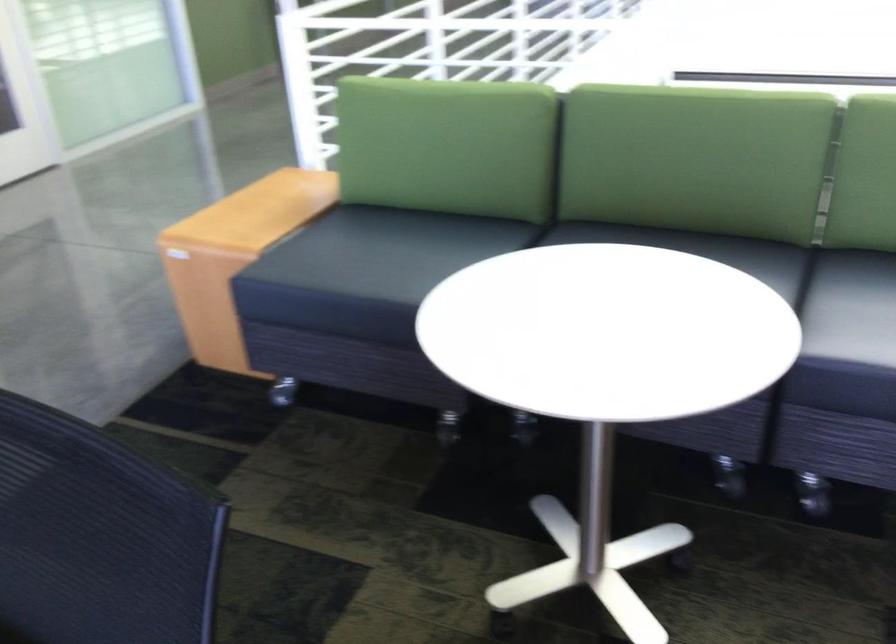
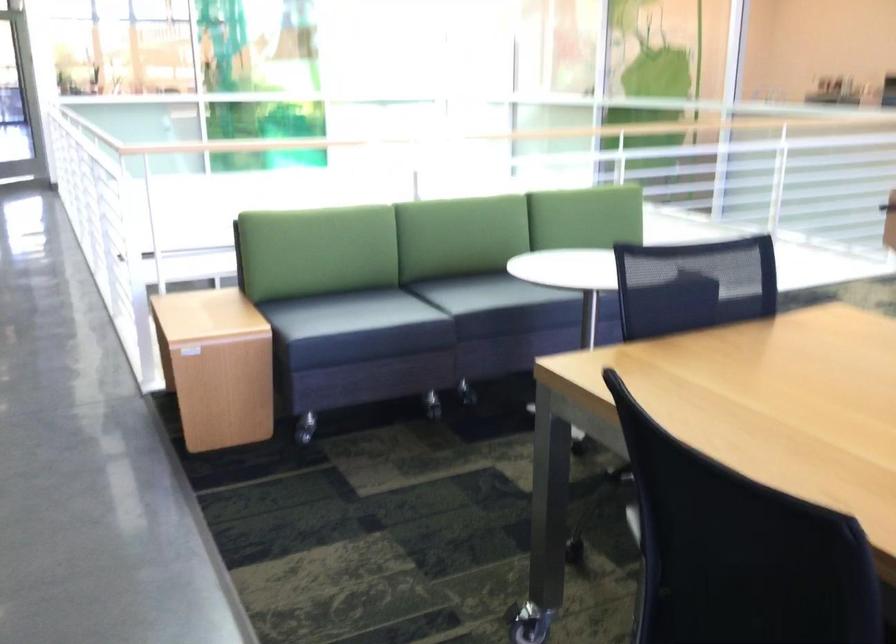
In the second image, find the point that corresponds to (x=395, y=401) in the first image.

(306, 427)